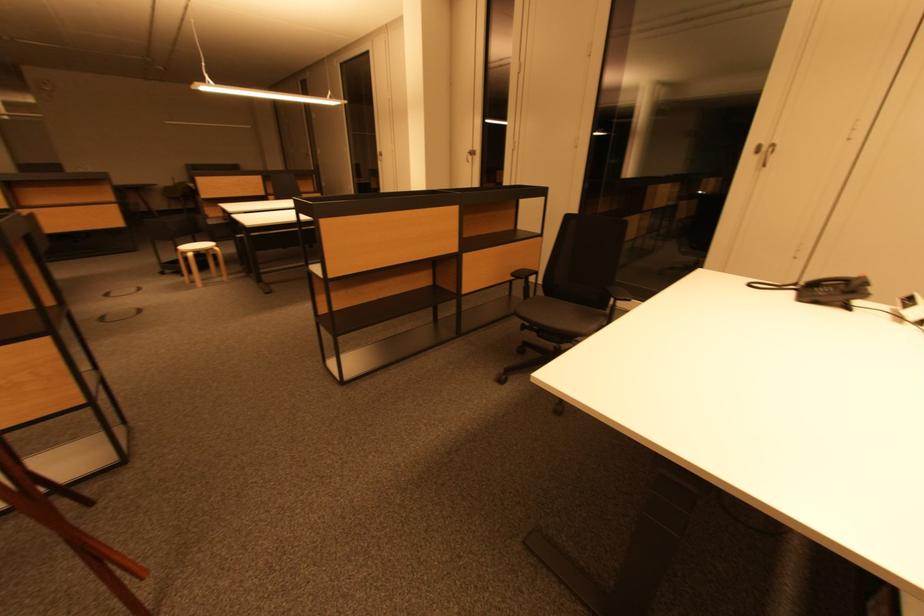
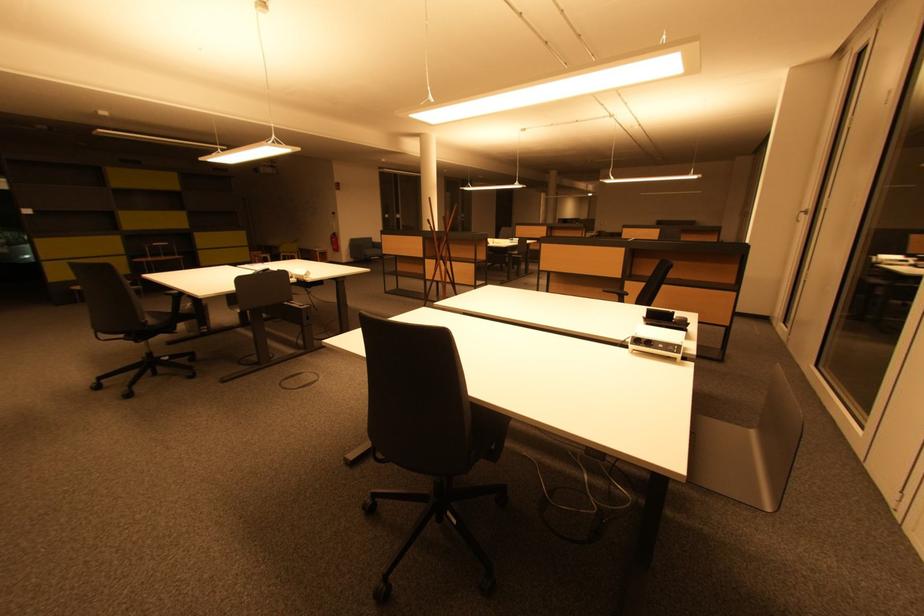
Where in the second image is the point corresponding to point (470, 152) from the first image?

(808, 212)